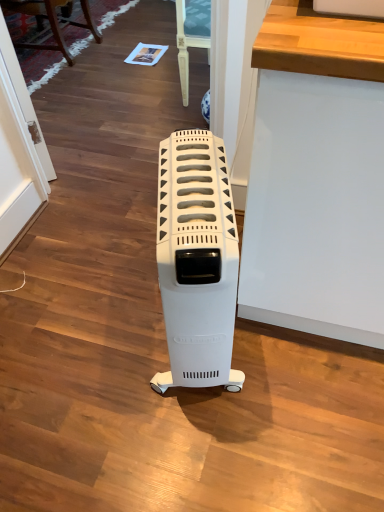
Question: Could you tell me if wooden chair at upper left is turned towards white plastic heater at center?

Choices:
 (A) yes
 (B) no

Answer: (B)

Question: Can you confirm if wooden chair at upper left is wider than white plastic heater at center?

Choices:
 (A) no
 (B) yes

Answer: (B)

Question: From a real-world perspective, is wooden chair at upper left located higher than white plastic heater at center?

Choices:
 (A) yes
 (B) no

Answer: (B)

Question: Does wooden chair at upper left appear on the left side of white plastic heater at center?

Choices:
 (A) no
 (B) yes

Answer: (B)

Question: Can you see wooden chair at upper left touching white plastic heater at center?

Choices:
 (A) yes
 (B) no

Answer: (B)

Question: From the image's perspective, is wooden chair at upper left over white plastic heater at center?

Choices:
 (A) yes
 (B) no

Answer: (A)

Question: Is white plastic heater at center facing away from wooden chair at upper left?

Choices:
 (A) yes
 (B) no

Answer: (B)

Question: Is white plastic heater at center outside of wooden chair at upper left?

Choices:
 (A) yes
 (B) no

Answer: (A)

Question: From the image's perspective, is white plastic heater at center located beneath wooden chair at upper left?

Choices:
 (A) yes
 (B) no

Answer: (A)

Question: Is white plastic heater at center further to camera compared to wooden chair at upper left?

Choices:
 (A) yes
 (B) no

Answer: (B)

Question: Is white plastic heater at center to the left of wooden chair at upper left from the viewer's perspective?

Choices:
 (A) yes
 (B) no

Answer: (B)

Question: Can you confirm if white plastic heater at center is taller than wooden chair at upper left?

Choices:
 (A) yes
 (B) no

Answer: (A)

Question: Is wooden chair at upper left in front of or behind white plastic heater at center in the image?

Choices:
 (A) front
 (B) behind

Answer: (B)